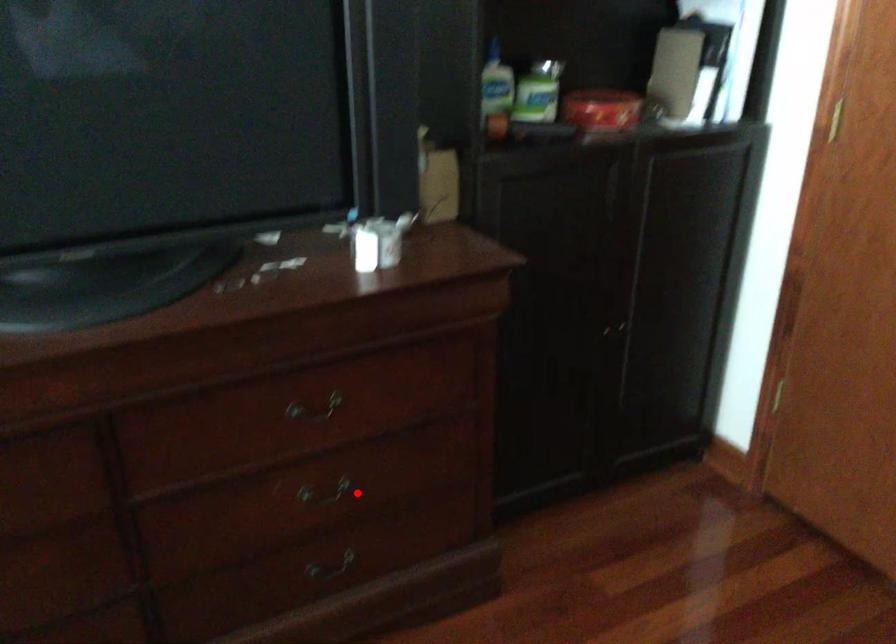
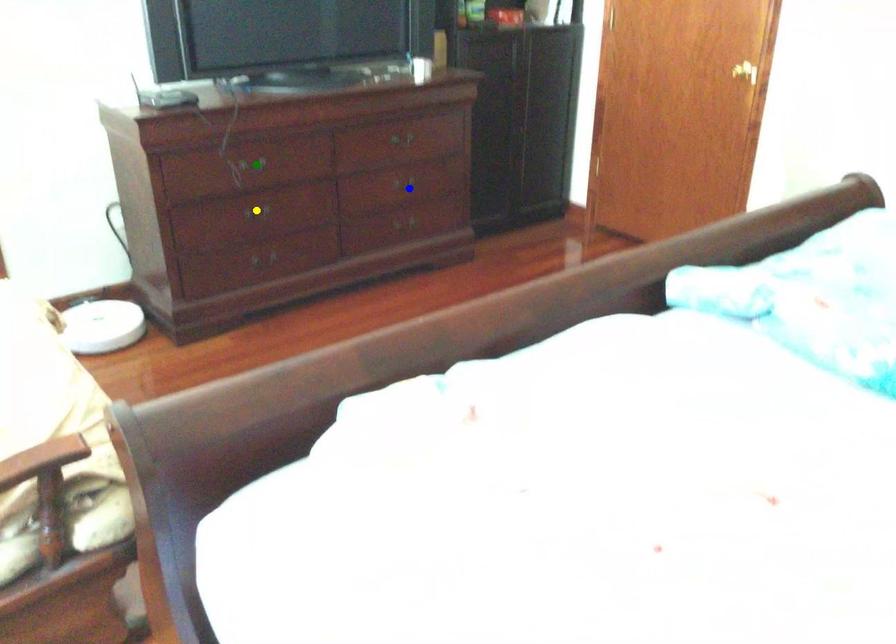
Question: I am providing you with two images of the same scene from different viewpoints. A red point is marked on the first image. You are given multiple points on the second image. Which point in image 2 represents the same 3d spot as the red point in image 1?

Choices:
 (A) yellow point
 (B) green point
 (C) blue point

Answer: (C)